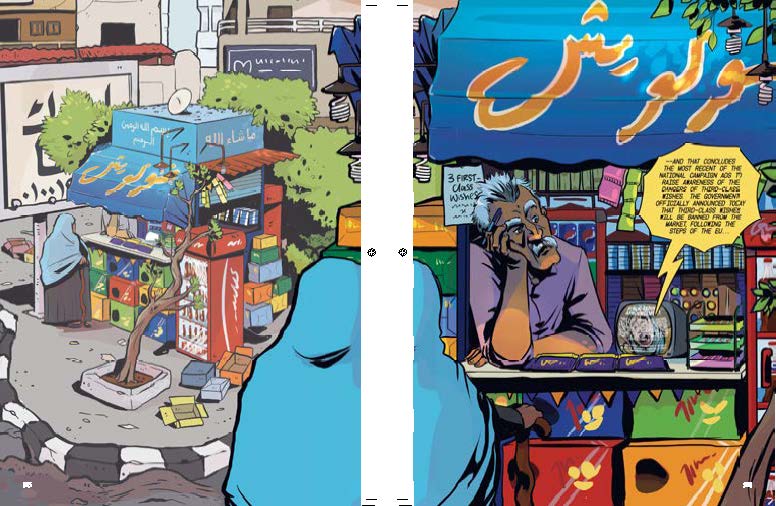
Where is `tv`? The width and height of the screenshot is (776, 506). tv is located at coordinates (636, 338).